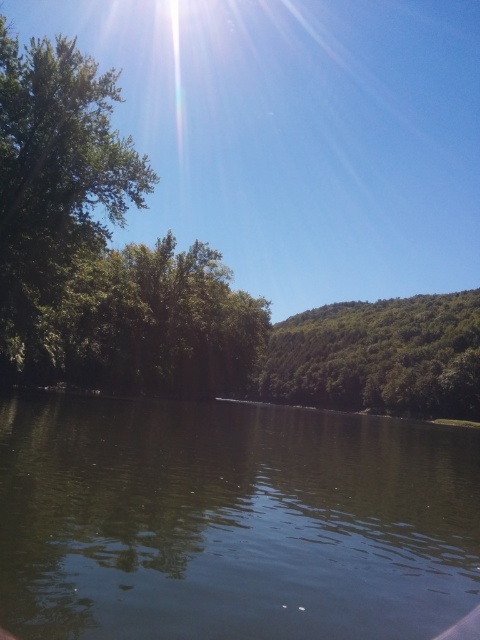
You are standing at the edge of the water and want to determine which object is closer to you between the green leafy tree at left and the green leafy hillside at center. Based on their sizes in the image, which one is nearer?

The green leafy tree at left is bigger than the green leafy hillside at center, so the green leafy tree at left is closer to you.

You are standing at the edge of the water and want to walk to the green leafy hillside at center. There is a green leafy tree at left blocking your path. Can you walk around the tree to reach the hillside?

The green leafy tree at left is wider than the green leafy hillside at center, so you can walk around the tree to reach the hillside.